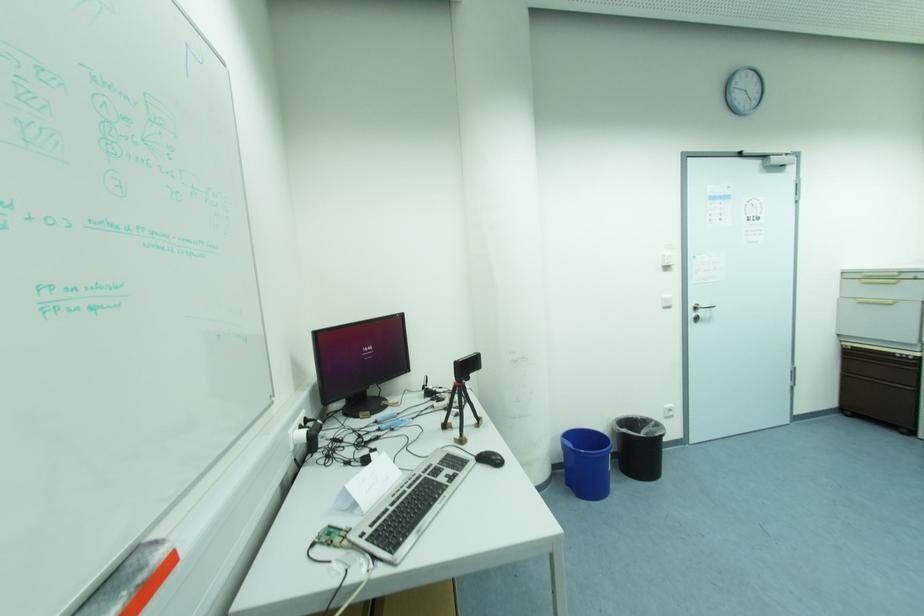
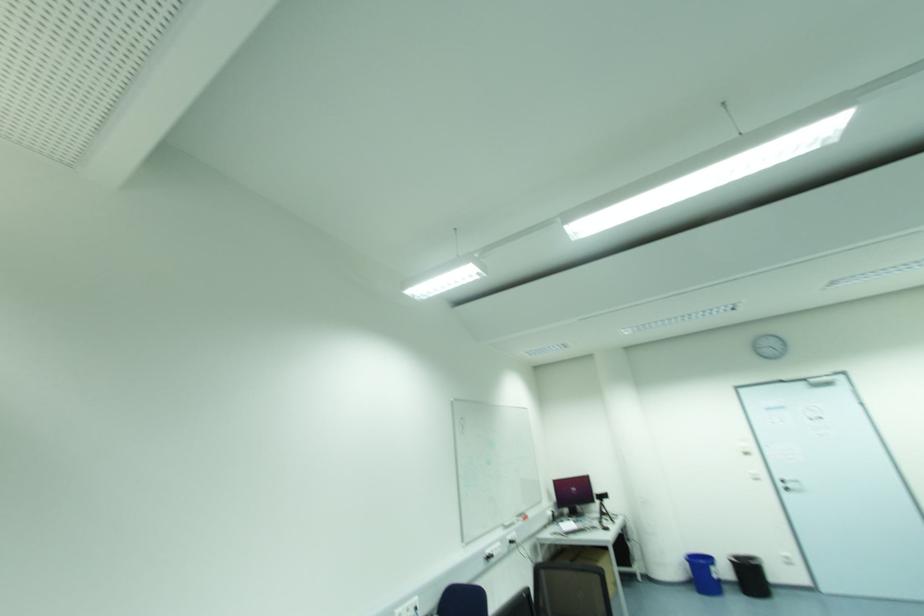
The point at (701, 314) is marked in the first image. Where is the corresponding point in the second image?

(789, 485)